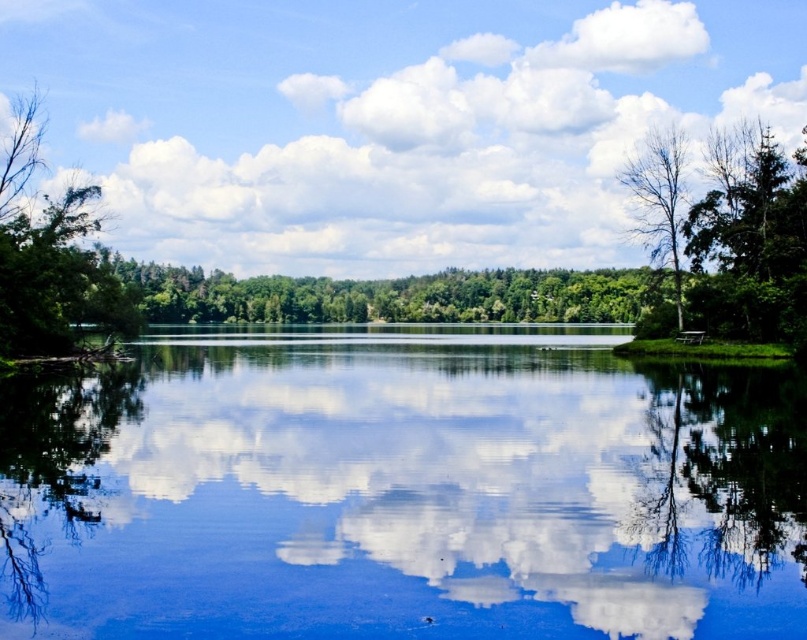
You are planning to set up a tent in the lakeside area. The green leafy tree at left and the bare wood tree at right are both nearby. Which tree has a wider canopy that might provide more shade?

The green leafy tree at left has a wider canopy than the bare wood tree at right, so it would provide more shade.

You are standing at the lakeside and want to take a photo of the point at coordinates [283,321]. Your camera has a maximum focus range of 250 meters. Will the camera be able to focus on the point?

The point at coordinates [283,321] is 255.10 meters away from the camera, which exceeds the maximum focus range of 250 meters. Therefore, the camera will not be able to focus on the point.

You are an artist trying to sketch the reflection of the white fluffy cloud at upper center in the transparent glass water at center. Which direction should you draw the reflection relative to the cloud?

The transparent glass water at center is positioned on the right side of white fluffy cloud at upper center, so you should draw the reflection to the right of the cloud.